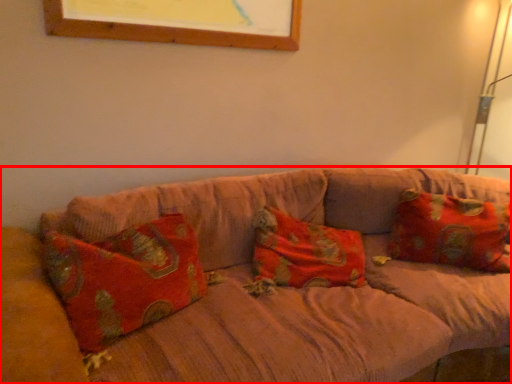
Question: From the image's perspective, where is studio couch (annotated by the red box) located relative to pillow?

Choices:
 (A) above
 (B) below

Answer: (B)